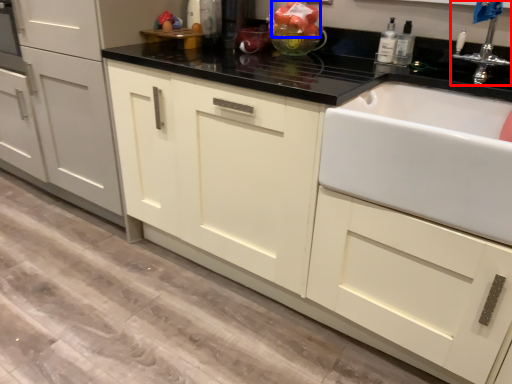
Question: Among these objects, which one is farthest to the camera, tap (highlighted by a red box) or fruit (highlighted by a blue box)?

Choices:
 (A) tap
 (B) fruit

Answer: (B)